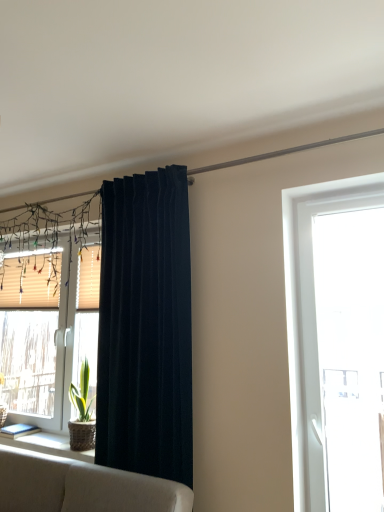
This screenshot has height=512, width=384. What are the coordinates of `free point above transparent glass door at right, the 1th window positioned from the right (from a real-world perspective)` in the screenshot? It's located at (340, 195).